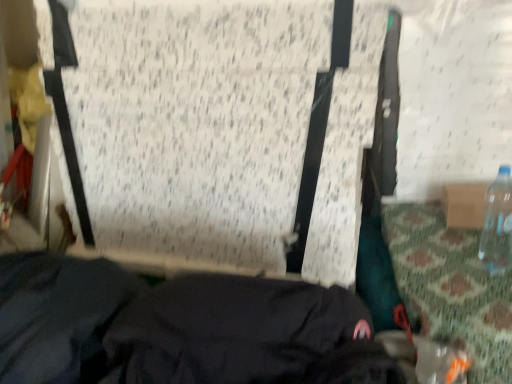
Question: Would you say clear plastic bottle at right is outside black fabric at lower center?

Choices:
 (A) yes
 (B) no

Answer: (A)

Question: Can you confirm if clear plastic bottle at right is positioned to the right of black fabric at lower center?

Choices:
 (A) no
 (B) yes

Answer: (B)

Question: Is clear plastic bottle at right positioned far away from black fabric at lower center?

Choices:
 (A) yes
 (B) no

Answer: (B)

Question: Can you confirm if clear plastic bottle at right is wider than black fabric at lower center?

Choices:
 (A) yes
 (B) no

Answer: (B)

Question: Is black fabric at lower center inside clear plastic bottle at right?

Choices:
 (A) yes
 (B) no

Answer: (B)

Question: From the image's perspective, would you say clear plastic bottle at right is positioned over black fabric at lower center?

Choices:
 (A) yes
 (B) no

Answer: (A)

Question: From a real-world perspective, is black fabric at lower center physically above clear plastic bottle at right?

Choices:
 (A) yes
 (B) no

Answer: (B)

Question: Is black fabric at lower center far from clear plastic bottle at right?

Choices:
 (A) no
 (B) yes

Answer: (A)

Question: Does black fabric at lower center have a smaller size compared to clear plastic bottle at right?

Choices:
 (A) no
 (B) yes

Answer: (A)

Question: Can you confirm if black fabric at lower center is shorter than clear plastic bottle at right?

Choices:
 (A) no
 (B) yes

Answer: (A)

Question: From the image's perspective, is black fabric at lower center over clear plastic bottle at right?

Choices:
 (A) yes
 (B) no

Answer: (B)

Question: From a real-world perspective, is black fabric at lower center beneath clear plastic bottle at right?

Choices:
 (A) yes
 (B) no

Answer: (A)

Question: From the image's perspective, is clear plastic bottle at right above or below black fabric at lower center?

Choices:
 (A) below
 (B) above

Answer: (B)